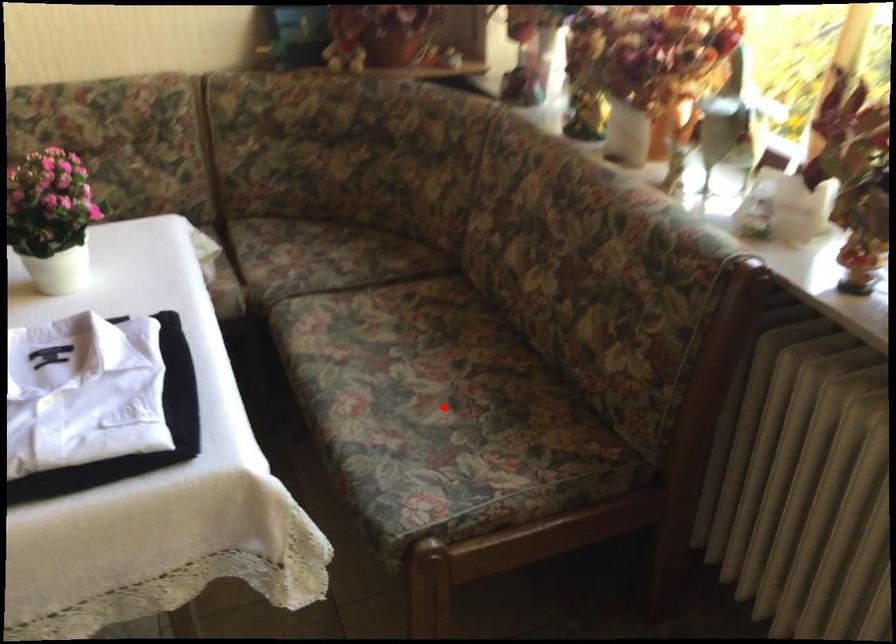
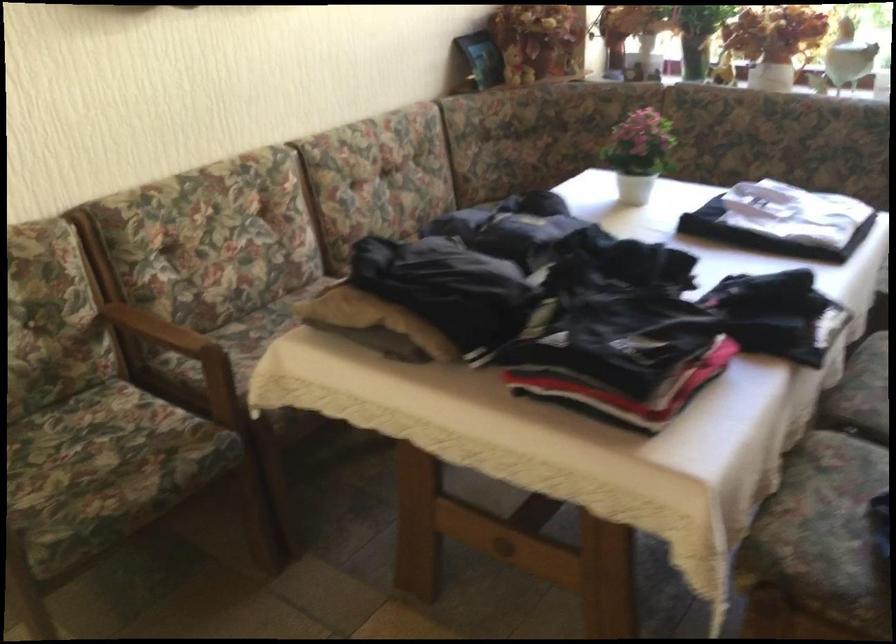
Question: I am providing you with two images of the same scene from different viewpoints. A red point is marked on the first image. Can you still see the location of the red point in image 2?

Choices:
 (A) Yes
 (B) No

Answer: (B)